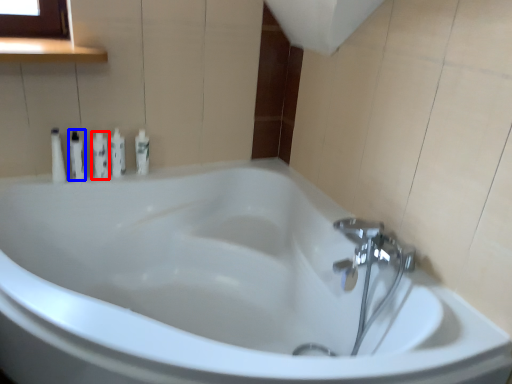
Question: Which object is further to the camera taking this photo, toiletry (highlighted by a red box) or toiletry (highlighted by a blue box)?

Choices:
 (A) toiletry
 (B) toiletry

Answer: (A)